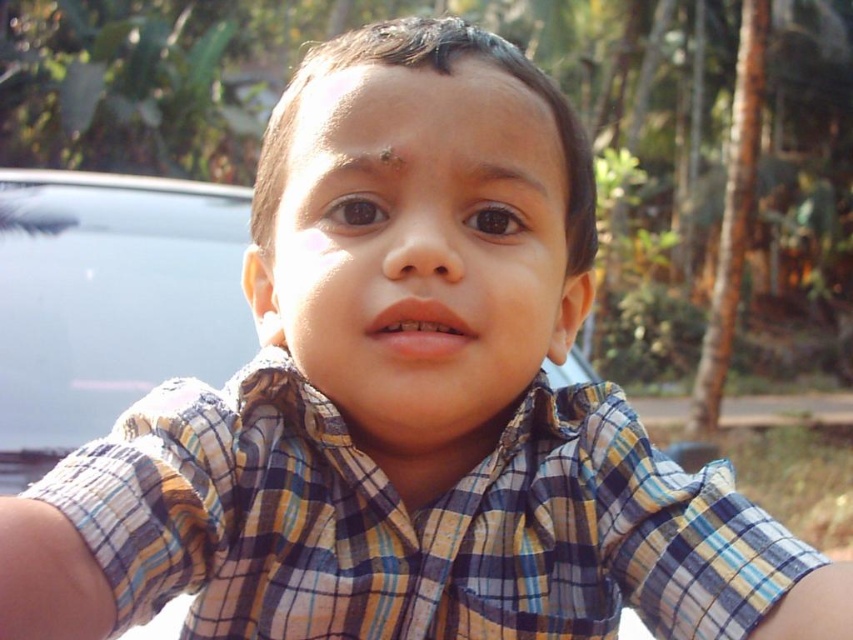
Question: Can you confirm if plaid shirt at center is positioned above metallic gray car at center?

Choices:
 (A) yes
 (B) no

Answer: (B)

Question: Does plaid shirt at center have a larger size compared to metallic gray car at center?

Choices:
 (A) no
 (B) yes

Answer: (A)

Question: Which of the following is the closest to the observer?

Choices:
 (A) metallic gray car at center
 (B) plaid shirt at center

Answer: (B)

Question: Which point is closer to the camera taking this photo?

Choices:
 (A) (44, 198)
 (B) (550, 536)

Answer: (B)

Question: Can you confirm if plaid shirt at center is positioned to the left of metallic gray car at center?

Choices:
 (A) no
 (B) yes

Answer: (A)